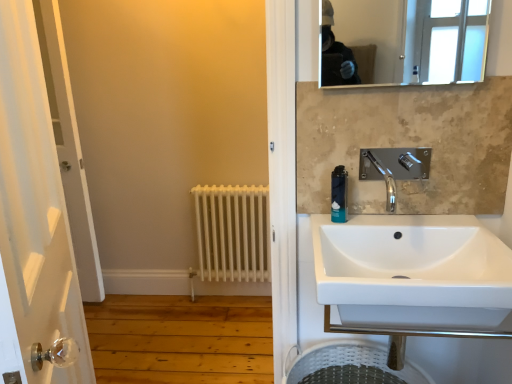
Where is `free space above white matte radiator at lower left (from a real-world perspective)`? free space above white matte radiator at lower left (from a real-world perspective) is located at coordinates (220, 188).